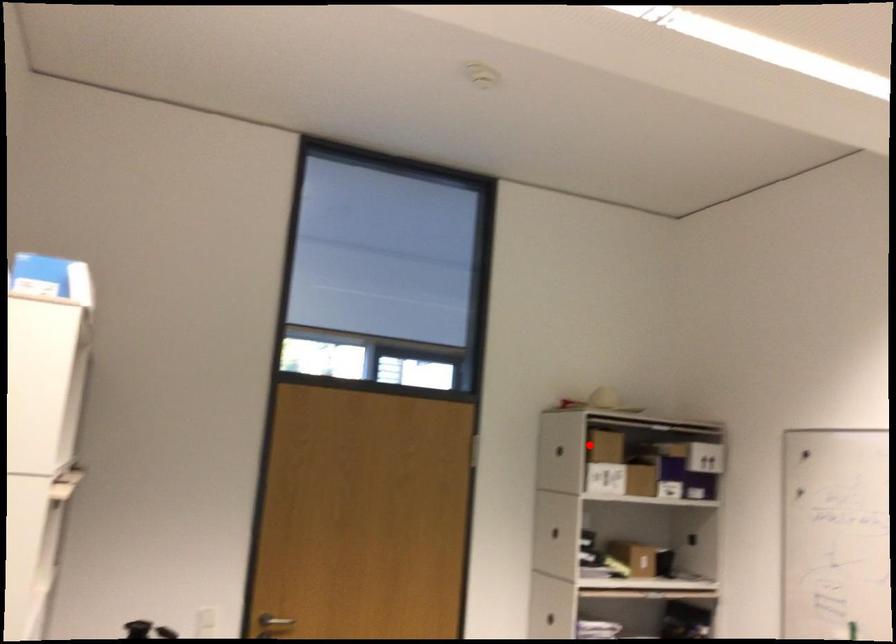
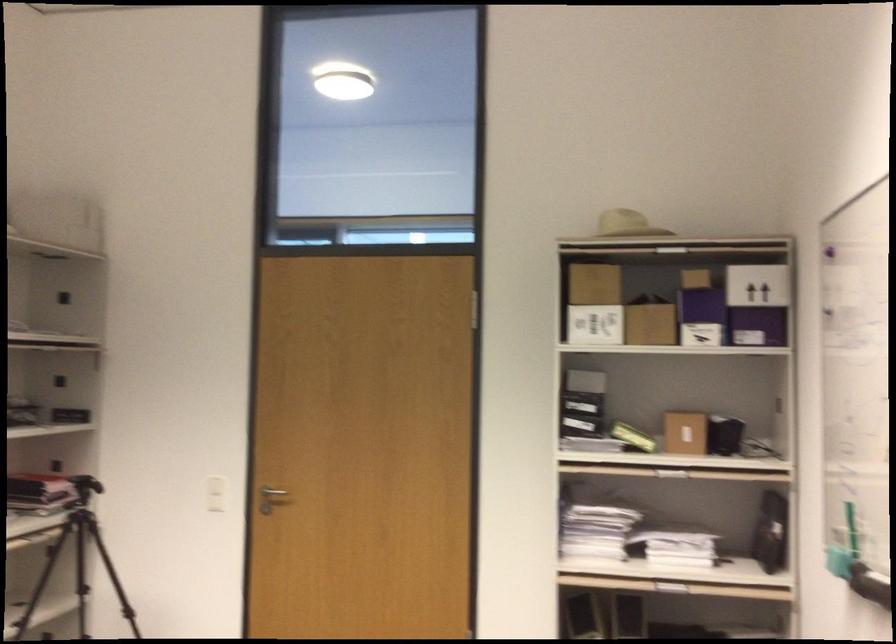
Where in the second image is the point corresponding to the highlighted location from the first image?

(592, 283)